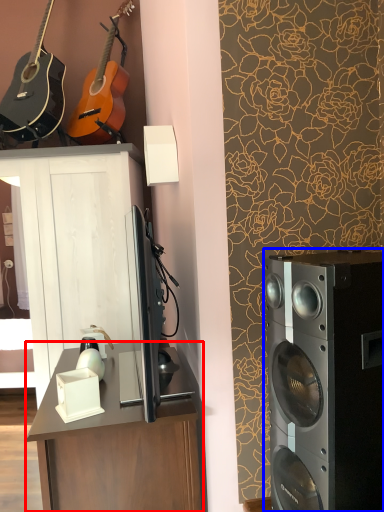
Question: Which point is further to the camera, desk (highlighted by a red box) or home appliance (highlighted by a blue box)?

Choices:
 (A) desk
 (B) home appliance

Answer: (A)